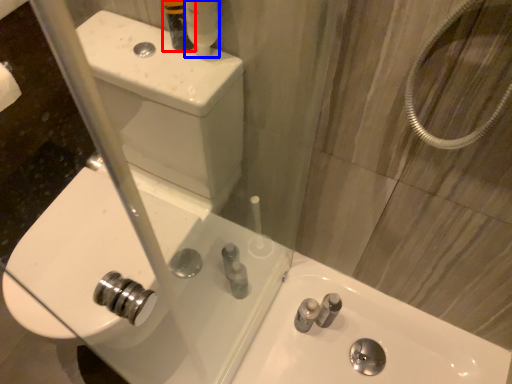
Question: Which point is closer to the camera, toiletry (highlighted by a red box) or mouthwash (highlighted by a blue box)?

Choices:
 (A) toiletry
 (B) mouthwash

Answer: (B)